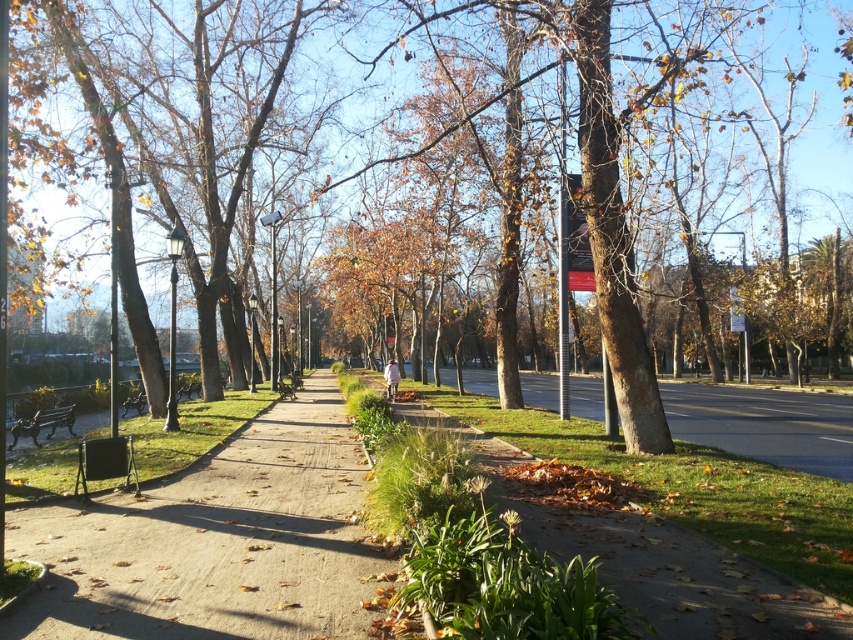
You are walking along the brown gravel sidewalk at center and want to take a photo of the brown wood tree at center. Since the sidewalk is in front of the tree, will you be able to see the tree clearly through the sidewalk?

The brown wood tree at center is in front of brown gravel sidewalk at center, so you can see the tree clearly because it is closer to you than the sidewalk.

You are planning to walk your dog in the park and want to choose the wider path to avoid obstacles. Which path should you choose between the smooth concrete path at center and the brown gravel sidewalk at center?

The brown gravel sidewalk at center is wider than the smooth concrete path at center, so you should choose the brown gravel sidewalk at center to avoid obstacles.